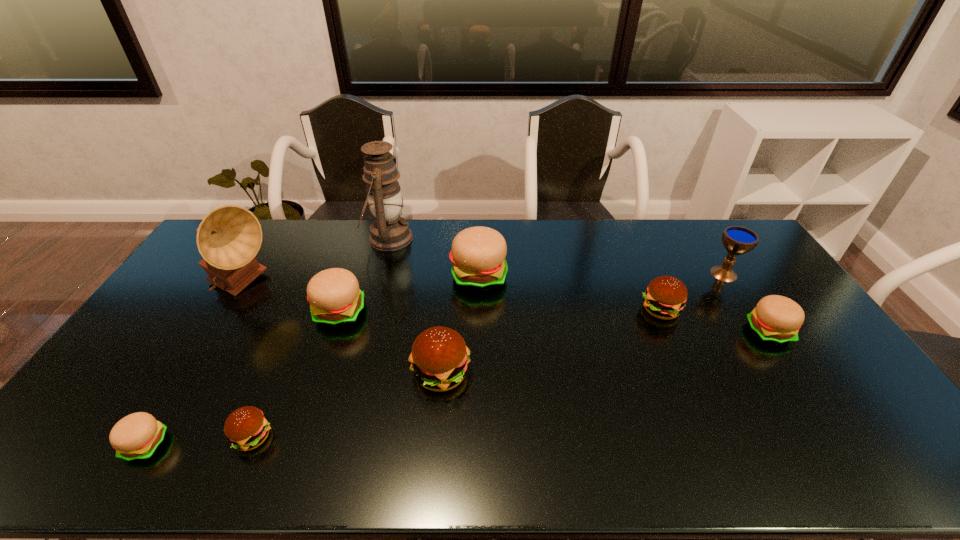
Locate an element on the screen. The image size is (960, 540). brown oil lamp is located at coordinates (389, 232).

Where is `oil lamp`? This screenshot has width=960, height=540. oil lamp is located at coordinates (389, 232).

Where is `the ninth shortest object`? The image size is (960, 540). the ninth shortest object is located at coordinates (229, 237).

Where is `the third beige hamburger from left to right`? the third beige hamburger from left to right is located at coordinates (478, 253).

You are a GUI agent. You are given a task and a screenshot of the screen. Output one action in this format:
    pyautogui.click(x=<x>, y=<y>)
    Task: Click on the farthest hamburger
    The height and width of the screenshot is (540, 960).
    Given the screenshot: What is the action you would take?
    pyautogui.click(x=478, y=253)

At what (x,y) coordinates should I click in order to perform the action: click on blue chalice. Please return your answer as a coordinate pair (x, y). The image size is (960, 540). Looking at the image, I should click on (737, 240).

Find the location of `the second nearest brown hamburger`. the second nearest brown hamburger is located at coordinates (439, 358).

Locate an element on the screen. This screenshot has height=540, width=960. the second brown hamburger from left to right is located at coordinates (439, 358).

Identify the location of the third beige hamburger from right to left. This screenshot has width=960, height=540. (335, 299).

This screenshot has height=540, width=960. In order to click on the third object from right to left in this screenshot , I will do `click(665, 297)`.